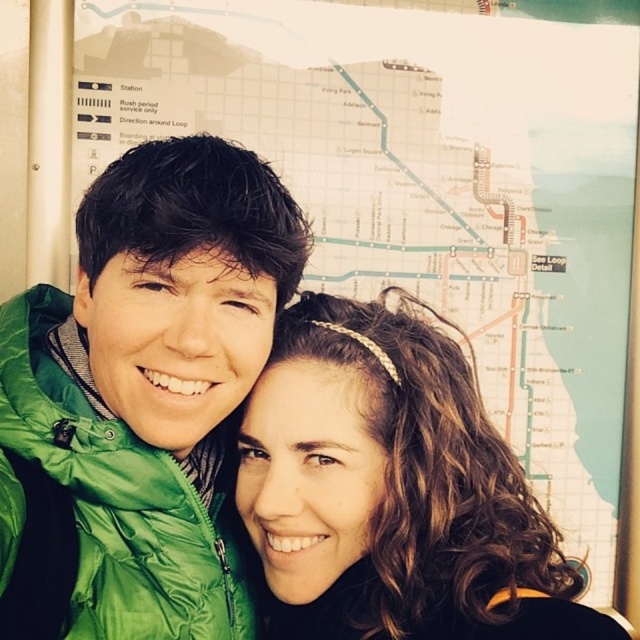
You are taking a photo of two people standing in front of a transit map. The green puffy jacket at left is above the brown curly hair at center. Can you tell me which object is higher in the photo?

The green puffy jacket at left is higher in the photo than the brown curly hair at center.

You are standing in front of a map in a transit station and see the point labeled as point (x=220, y=589). The map shows a station marked with the label

The point labeled as point (x=220, y=589) is 3.62 feet away from you, so you can easily reach it without any difficulty.

You are taking a photo with two friends. You notice the green puffy jacket at left and brown curly hair at center in the frame. Which object appears taller in the photo?

The green puffy jacket at left appears taller than the brown curly hair at center in the photo.